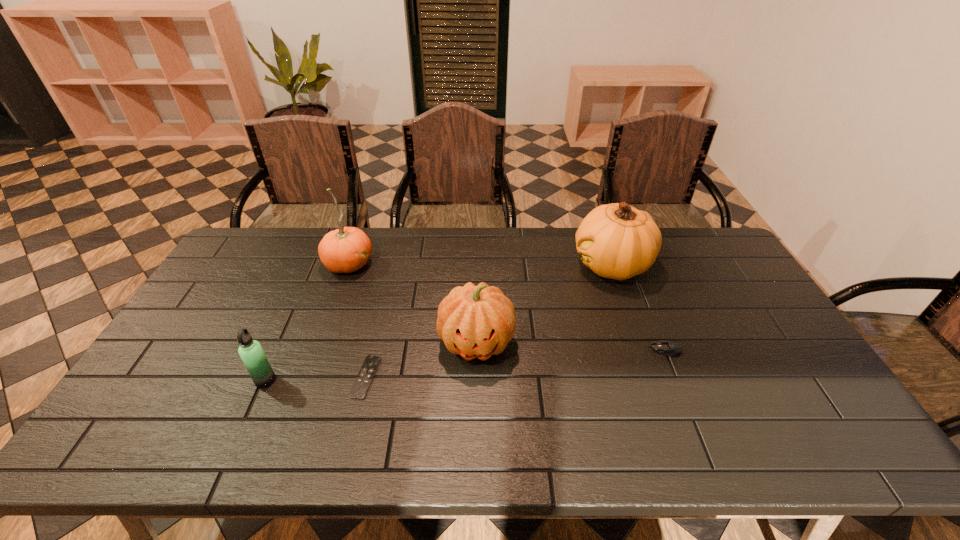
Where is `object that is the fourth closest to the thermos bottle`? The width and height of the screenshot is (960, 540). object that is the fourth closest to the thermos bottle is located at coordinates (617, 241).

The width and height of the screenshot is (960, 540). In order to click on pumpkin object that ranks as the closest to the computer mouse in this screenshot , I will do `click(617, 241)`.

Locate an element on the screen. pumpkin that can be found as the second closest to the rightmost pumpkin is located at coordinates (347, 249).

At what (x,y) coordinates should I click in order to perform the action: click on vacant space that satisfies the following two spatial constraints: 1. on the front face of the computer mouse; 2. on the left side of the rightmost pumpkin. Please return your answer as a coordinate pair (x, y). This screenshot has width=960, height=540. Looking at the image, I should click on (641, 350).

Where is `vacant point that satisfies the following two spatial constraints: 1. on the front face of the rightmost pumpkin; 2. on the back side of the computer mouse`? Image resolution: width=960 pixels, height=540 pixels. vacant point that satisfies the following two spatial constraints: 1. on the front face of the rightmost pumpkin; 2. on the back side of the computer mouse is located at coordinates coord(641,350).

This screenshot has width=960, height=540. In order to click on vacant position in the image that satisfies the following two spatial constraints: 1. on the front face of the rightmost pumpkin; 2. on the carved face of the second pumpkin from right to left in this screenshot , I will do 639,342.

In order to click on free space in the image that satisfies the following two spatial constraints: 1. on the front face of the rightmost pumpkin; 2. on the back side of the second shortest object in this screenshot , I will do `click(641, 350)`.

The width and height of the screenshot is (960, 540). In order to click on vacant space that satisfies the following two spatial constraints: 1. on the front side of the leftmost pumpkin; 2. on the right side of the computer mouse in this screenshot , I will do `click(319, 350)`.